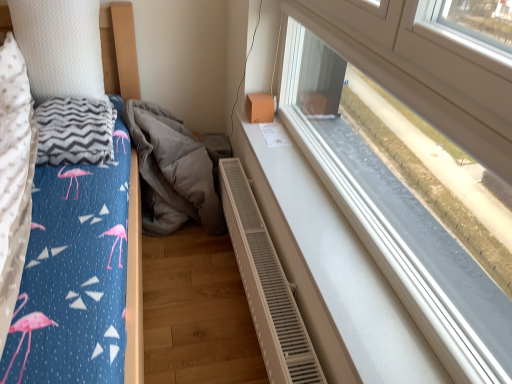
Question: Could gray fabric at lower center be considered to be inside white textured pillow at upper left?

Choices:
 (A) yes
 (B) no

Answer: (B)

Question: Does white textured pillow at upper left have a greater width compared to gray fabric at lower center?

Choices:
 (A) yes
 (B) no

Answer: (B)

Question: From a real-world perspective, is white textured pillow at upper left beneath gray fabric at lower center?

Choices:
 (A) no
 (B) yes

Answer: (A)

Question: From a real-world perspective, does white textured pillow at upper left stand above gray fabric at lower center?

Choices:
 (A) yes
 (B) no

Answer: (A)

Question: Considering the relative sizes of white textured pillow at upper left and gray fabric at lower center in the image provided, is white textured pillow at upper left smaller than gray fabric at lower center?

Choices:
 (A) yes
 (B) no

Answer: (A)

Question: Is white textured pillow at upper left shorter than gray fabric at lower center?

Choices:
 (A) no
 (B) yes

Answer: (B)

Question: Is white plastic window at upper right in contact with gray fabric at lower center?

Choices:
 (A) yes
 (B) no

Answer: (B)

Question: Is white plastic window at upper right taller than gray fabric at lower center?

Choices:
 (A) no
 (B) yes

Answer: (B)

Question: Does white plastic window at upper right appear on the left side of gray fabric at lower center?

Choices:
 (A) no
 (B) yes

Answer: (A)

Question: Is gray fabric at lower center inside white plastic window at upper right?

Choices:
 (A) no
 (B) yes

Answer: (A)

Question: From a real-world perspective, is white plastic window at upper right below gray fabric at lower center?

Choices:
 (A) no
 (B) yes

Answer: (A)

Question: From the image's perspective, is white plastic window at upper right on gray fabric at lower center?

Choices:
 (A) yes
 (B) no

Answer: (A)

Question: From a real-world perspective, is white textured radiator at lower center over white textured pillow at upper left?

Choices:
 (A) no
 (B) yes

Answer: (A)